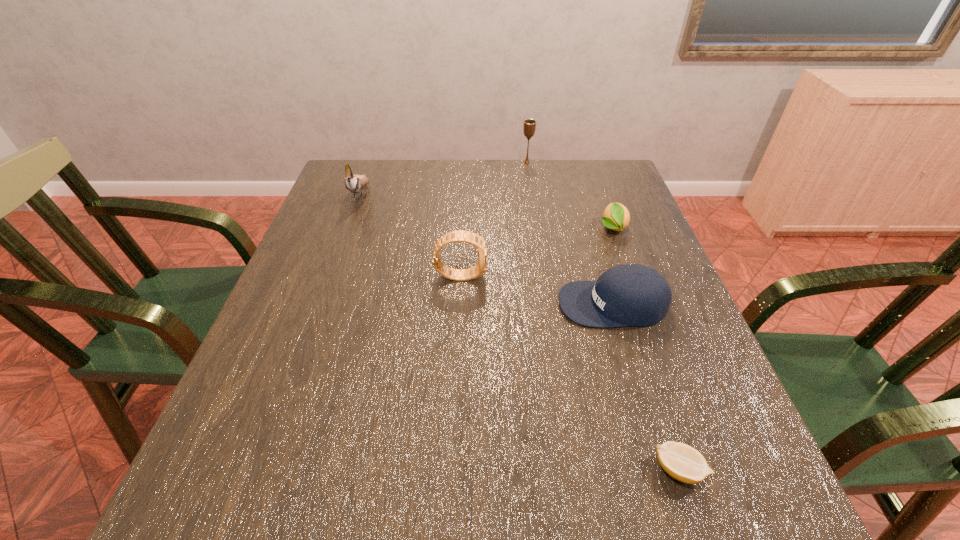
You are a GUI agent. You are given a task and a screenshot of the screen. Output one action in this format:
    pyautogui.click(x=<x>, y=<y>)
    Task: Click on the vacant space situated 0.280m on the front of the farthest object
    The width and height of the screenshot is (960, 540).
    Given the screenshot: What is the action you would take?
    pyautogui.click(x=536, y=217)

Find the location of a particular element. The image size is (960, 540). free spot located at the face of the fifth nearest object is located at coordinates (344, 239).

Where is `vacant space situated on the face of the second object from left to right`? The height and width of the screenshot is (540, 960). vacant space situated on the face of the second object from left to right is located at coordinates (577, 275).

Identify the location of vacant region located on the front-facing side of the third shortest object. The width and height of the screenshot is (960, 540). (516, 304).

Identify the location of vacant space located on the front-facing side of the third shortest object. Image resolution: width=960 pixels, height=540 pixels. (470, 304).

Locate an element on the screen. Image resolution: width=960 pixels, height=540 pixels. vacant space situated 0.260m on the front-facing side of the third shortest object is located at coordinates coord(439,304).

The width and height of the screenshot is (960, 540). Identify the location of vacant region located 0.320m with leaves positioned above the fourth nearest object. (654, 340).

Find the location of a particular element. Image resolution: width=960 pixels, height=540 pixels. vacant point located 0.100m on the left of the shortest object is located at coordinates (591, 470).

Identify the location of chalice at the far edge. (529, 127).

The image size is (960, 540). Identify the location of bird that is at the far edge. (354, 183).